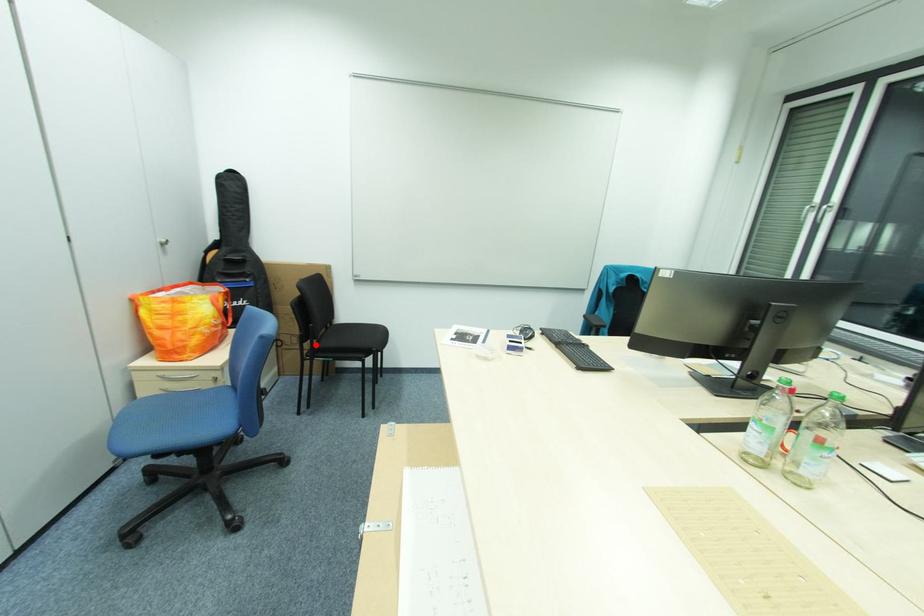
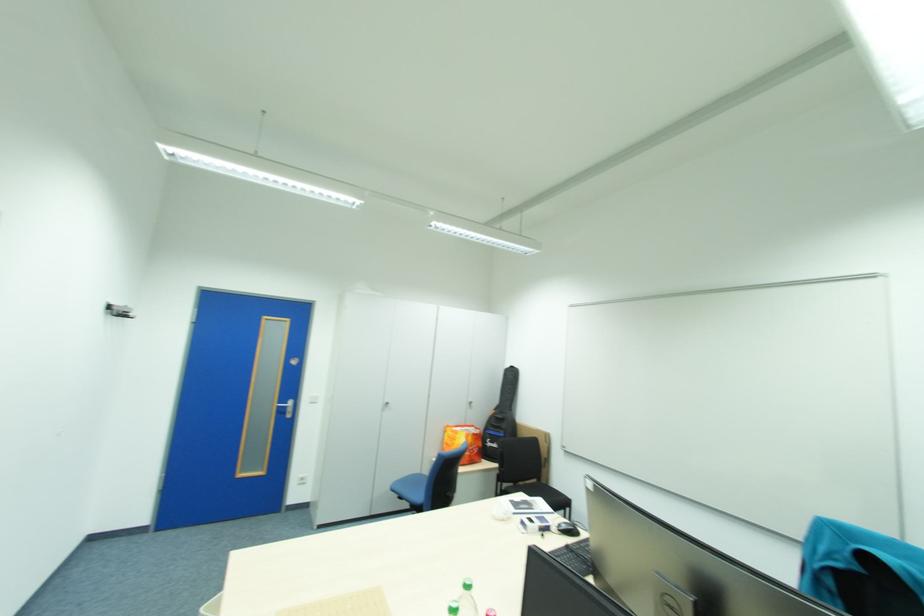
Question: A red point is marked in image1. In image2, is the corresponding 3D point closer to the camera or farther? Reply with the corresponding letter.

Choices:
 (A) The corresponding 3D point is closer.
 (B) The corresponding 3D point is farther.

Answer: (B)